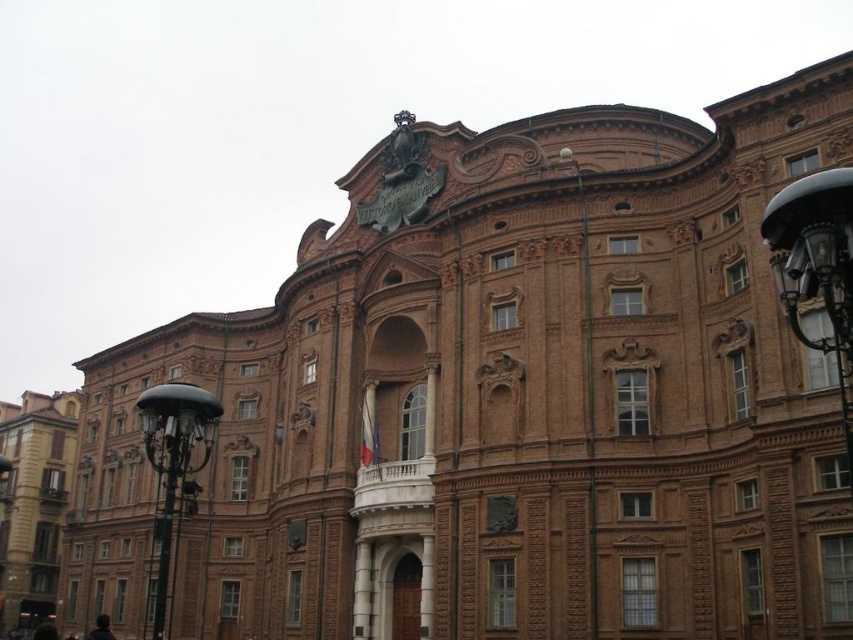
Question: Which point appears farthest from the camera in this image?

Choices:
 (A) (25, 515)
 (B) (593, 508)

Answer: (A)

Question: Which point appears farthest from the camera in this image?

Choices:
 (A) (827, 348)
 (B) (403, 172)
 (C) (184, 454)
 (D) (35, 508)

Answer: (D)

Question: Is black metal lamp post at right positioned in front of polished brass lamp post at center?

Choices:
 (A) yes
 (B) no

Answer: (A)

Question: Does brown brick building at lower left have a lesser width compared to polished black lamp post at left?

Choices:
 (A) yes
 (B) no

Answer: (B)

Question: Does black metal lamp post at right appear over bronze statue at upper center?

Choices:
 (A) yes
 (B) no

Answer: (B)

Question: Which point is closer to the camera?

Choices:
 (A) coord(595,577)
 (B) coord(0,513)

Answer: (A)